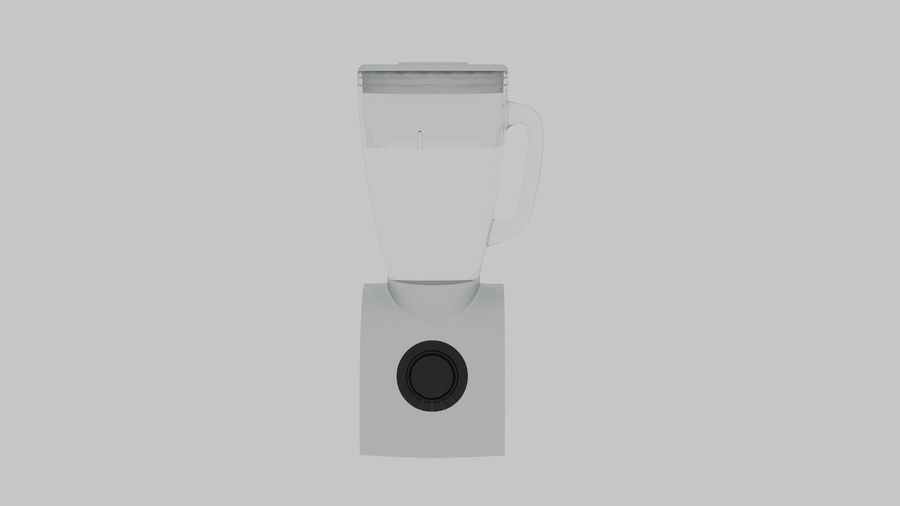
Find the location of `handle`. handle is located at coordinates (531, 184).